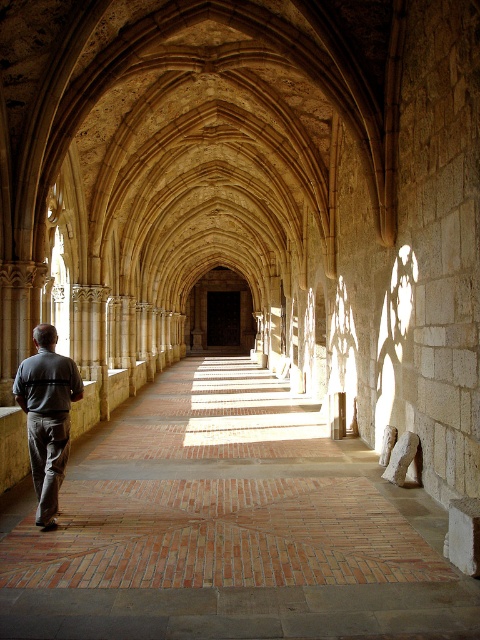
Is brick at center shorter than gray cotton pants at center?

Yes.

Does brick at center appear on the left side of gray cotton pants at center?

No, brick at center is not to the left of gray cotton pants at center.

You are a GUI agent. You are given a task and a screenshot of the screen. Output one action in this format:
    pyautogui.click(x=<x>, y=<y>)
    Task: Click on the brick at center
    The image size is (480, 640).
    Given the screenshot: What is the action you would take?
    pos(228,525)